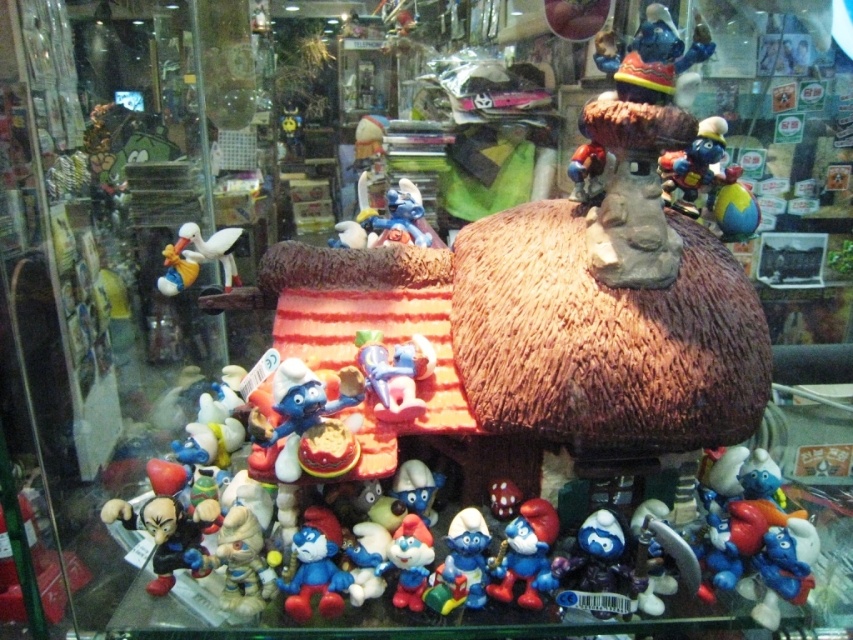
Question: Which is nearer to the matte blue plastic smurf at lower center?

Choices:
 (A) shiny metallic figurine at upper right
 (B) white matte figurine at lower left
 (C) matte plastic smurf at center

Answer: (C)

Question: Where is blue matte smurf at center located in relation to white matte figurine at lower left in the image?

Choices:
 (A) above
 (B) below

Answer: (A)

Question: Is blue matte smurf at center bigger than smooth blue figurine at center?

Choices:
 (A) yes
 (B) no

Answer: (A)

Question: Which of the following is the closest to the observer?

Choices:
 (A) (297, 536)
 (B) (399, 604)

Answer: (A)

Question: Which point is farther from the camera taking this photo?

Choices:
 (A) (426, 356)
 (B) (165, 275)

Answer: (B)

Question: Can you confirm if blue matte smurf at center is positioned below white glossy stork at left?

Choices:
 (A) yes
 (B) no

Answer: (A)